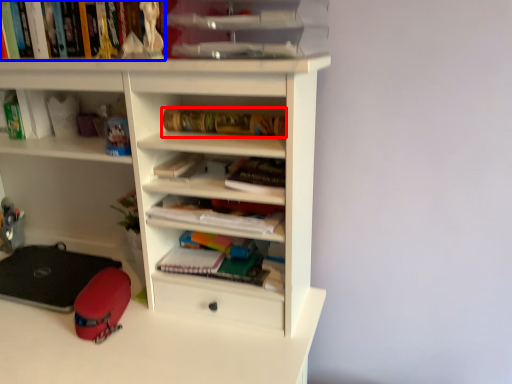
Question: Among these objects, which one is nearest to the camera, book (highlighted by a red box) or book (highlighted by a blue box)?

Choices:
 (A) book
 (B) book

Answer: (B)